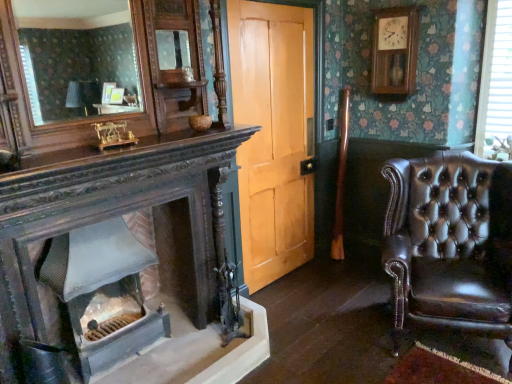
Question: Does white plastic blinds at upper right appear on the left side of light brown wood door at center?

Choices:
 (A) no
 (B) yes

Answer: (A)

Question: Does white plastic blinds at upper right have a greater height compared to light brown wood door at center?

Choices:
 (A) yes
 (B) no

Answer: (B)

Question: From a real-world perspective, is white plastic blinds at upper right physically below light brown wood door at center?

Choices:
 (A) yes
 (B) no

Answer: (B)

Question: From a real-world perspective, is white plastic blinds at upper right located higher than light brown wood door at center?

Choices:
 (A) yes
 (B) no

Answer: (A)

Question: Considering the relative sizes of white plastic blinds at upper right and light brown wood door at center in the image provided, is white plastic blinds at upper right smaller than light brown wood door at center?

Choices:
 (A) no
 (B) yes

Answer: (B)

Question: Does white plastic blinds at upper right have a larger size compared to light brown wood door at center?

Choices:
 (A) yes
 (B) no

Answer: (B)

Question: Is shiny brown leather armchair at right bigger than white plastic blinds at upper right?

Choices:
 (A) no
 (B) yes

Answer: (B)

Question: Is shiny brown leather armchair at right thinner than white plastic blinds at upper right?

Choices:
 (A) yes
 (B) no

Answer: (B)

Question: From a real-world perspective, is shiny brown leather armchair at right physically below white plastic blinds at upper right?

Choices:
 (A) yes
 (B) no

Answer: (A)

Question: Is shiny brown leather armchair at right further to the viewer compared to white plastic blinds at upper right?

Choices:
 (A) yes
 (B) no

Answer: (B)

Question: Does shiny brown leather armchair at right have a smaller size compared to white plastic blinds at upper right?

Choices:
 (A) no
 (B) yes

Answer: (A)

Question: Does shiny brown leather armchair at right come in front of white plastic blinds at upper right?

Choices:
 (A) yes
 (B) no

Answer: (A)

Question: Is the depth of smooth gray stone fireplace at lower left greater than that of shiny brown leather armchair at right?

Choices:
 (A) no
 (B) yes

Answer: (B)